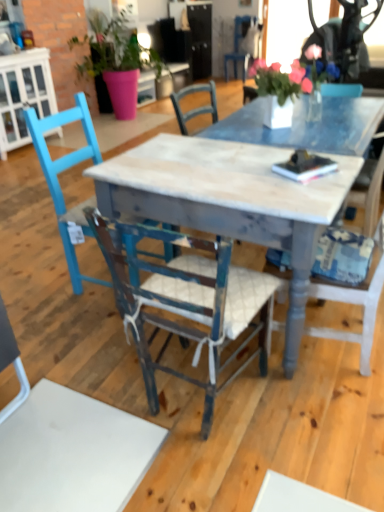
Question: Is blue painted wood chair at left, the second chair from the top, looking in the opposite direction of wooden chair at center, placed as the fourth chair when sorted from bottom to top?

Choices:
 (A) yes
 (B) no

Answer: (B)

Question: Is blue painted wood chair at left, which appears as the third chair when ordered from the bottom, in front of wooden chair at center, placed as the fourth chair when sorted from bottom to top?

Choices:
 (A) no
 (B) yes

Answer: (B)

Question: From the image's perspective, does blue painted wood chair at left, the third chair when ordered from front to back, appear lower than wooden chair at center, the 4th chair viewed from the front?

Choices:
 (A) no
 (B) yes

Answer: (B)

Question: From the image's perspective, does blue painted wood chair at left, the third chair when ordered from front to back, appear higher than wooden chair at center, the 4th chair viewed from the front?

Choices:
 (A) no
 (B) yes

Answer: (A)

Question: Is blue painted wood chair at left, the 2th chair in the back-to-front sequence, completely or partially outside of wooden chair at center, the 4th chair viewed from the front?

Choices:
 (A) yes
 (B) no

Answer: (A)

Question: From the image's perspective, is matte pink pot at upper left located above or below white fabric chair at center, the 2th chair positioned from the front?

Choices:
 (A) above
 (B) below

Answer: (A)

Question: Is matte pink pot at upper left in front of or behind white fabric chair at center, which appears as the second chair when ordered from the bottom, in the image?

Choices:
 (A) front
 (B) behind

Answer: (B)

Question: Looking at the image, does matte pink pot at upper left seem bigger or smaller compared to white fabric chair at center, the 3th chair positioned from the top?

Choices:
 (A) small
 (B) big

Answer: (B)

Question: Would you say matte pink pot at upper left is inside or outside white fabric chair at center, arranged as the 3th chair when viewed from the back?

Choices:
 (A) outside
 (B) inside

Answer: (A)

Question: In terms of height, does wooden chair at center, the 4th chair viewed from the front, look taller or shorter compared to white fabric chair at center, arranged as the 3th chair when viewed from the back?

Choices:
 (A) short
 (B) tall

Answer: (B)

Question: Considering the positions of point (x=241, y=54) and point (x=365, y=214), is point (x=241, y=54) closer or farther from the camera than point (x=365, y=214)?

Choices:
 (A) farther
 (B) closer

Answer: (A)

Question: Based on their positions, is wooden chair at center, which is counted as the first chair, starting from the top, located to the left or right of white fabric chair at center, arranged as the 3th chair when viewed from the back?

Choices:
 (A) left
 (B) right

Answer: (B)

Question: In the image, is wooden chair at center, the 4th chair viewed from the front, positioned in front of or behind white fabric chair at center, the 3th chair positioned from the top?

Choices:
 (A) behind
 (B) front

Answer: (A)

Question: From a real-world perspective, is wooden chair at center, which is counted as the first chair, starting from the top, physically located above or below matte pink pot at upper left?

Choices:
 (A) below
 (B) above

Answer: (A)

Question: Based on their sizes in the image, would you say wooden chair at center, the first chair when ordered from back to front, is bigger or smaller than matte pink pot at upper left?

Choices:
 (A) small
 (B) big

Answer: (A)